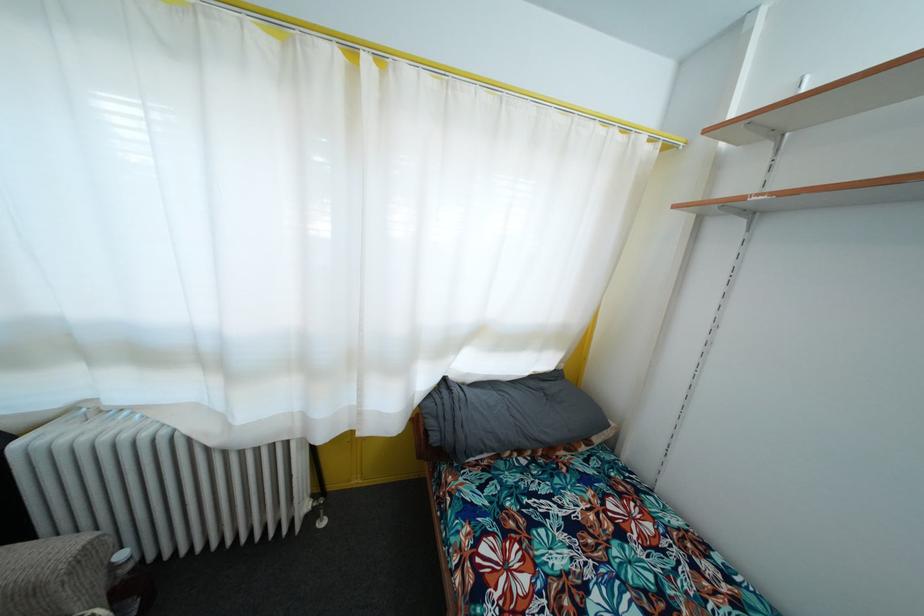
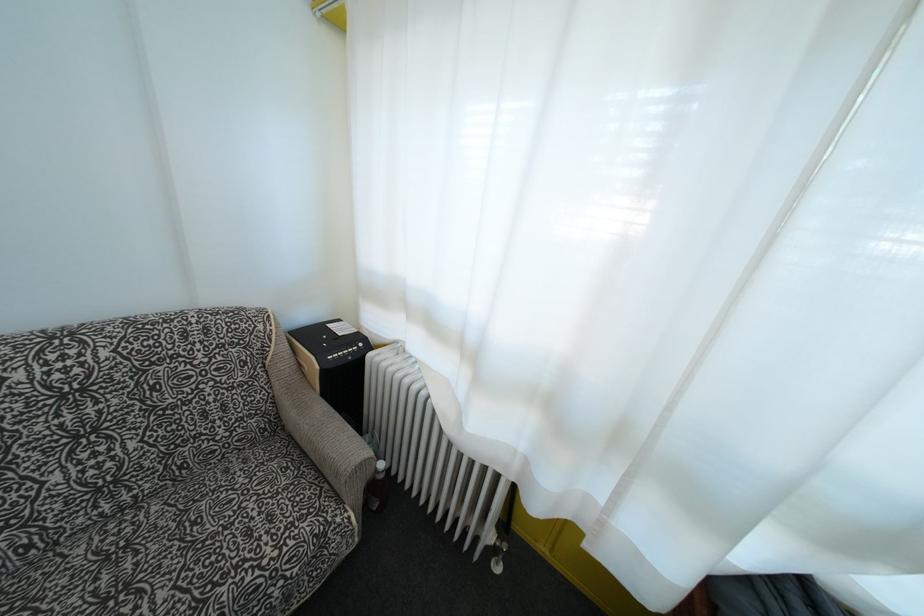
Question: The first image is from the beginning of the video and the second image is from the end. How did the camera likely rotate when shooting the video?

Choices:
 (A) Left
 (B) Right
 (C) Up
 (D) Down

Answer: (A)